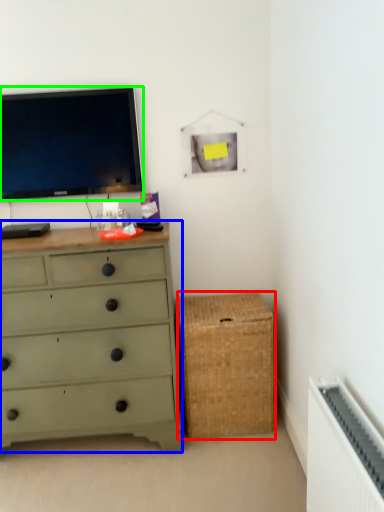
Question: Based on their relative distances, which object is farther from storage box (highlighted by a red box)? Choose from chest of drawers (highlighted by a blue box) and television (highlighted by a green box).

Choices:
 (A) chest of drawers
 (B) television

Answer: (B)